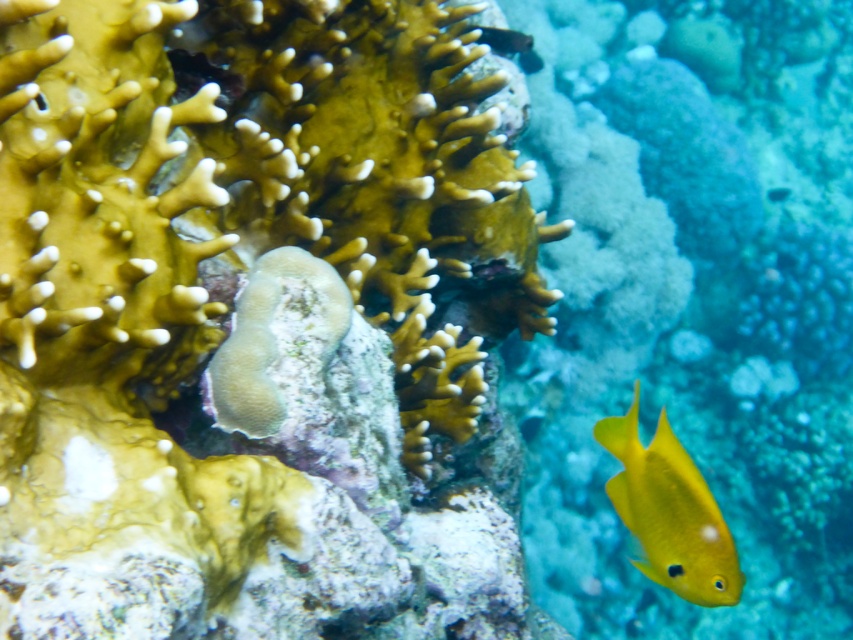
Can you confirm if smooth yellow coral at center is shorter than yellow matte fish at right?

No.

Is point (360, 598) positioned after point (692, 560)?

No, it is in front of (692, 560).

The image size is (853, 640). I want to click on smooth yellow coral at center, so click(x=257, y=323).